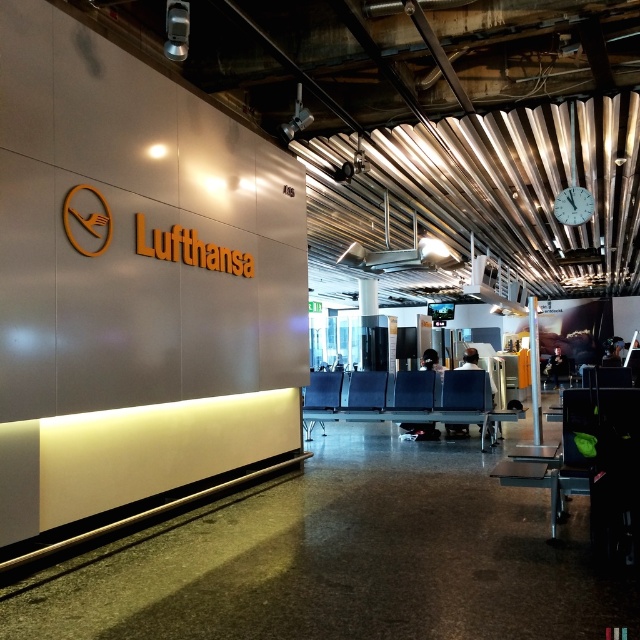
Does black plastic chair at right have a greater width compared to black leather chair at center?

Yes, black plastic chair at right is wider than black leather chair at center.

Between point (577, 461) and point (452, 378), which one is positioned in front?

Point (577, 461) is more forward.

Is point (572, 449) more distant than point (445, 410)?

No, (572, 449) is closer to viewer.

Image resolution: width=640 pixels, height=640 pixels. What are the coordinates of `black plastic chair at right` in the screenshot? It's located at pyautogui.click(x=570, y=445).

Measure the distance between metallic blue chair at center and camera.

They are 8.46 meters apart.

Which is in front, point (320, 419) or point (580, 211)?

Positioned in front is point (580, 211).

Identify the location of metallic blue chair at center. The width and height of the screenshot is (640, 640). (323, 392).

Who is more forward, [547,460] or [584,208]?

Point [547,460]

Measure the distance from black plastic chair at right to metallic clock at upper right.

black plastic chair at right and metallic clock at upper right are 3.40 meters apart from each other.

Who is more distant from viewer, (x=614, y=420) or (x=579, y=220)?

Point (x=579, y=220)

The image size is (640, 640). Find the location of `black plastic chair at right`. black plastic chair at right is located at coordinates (570, 445).